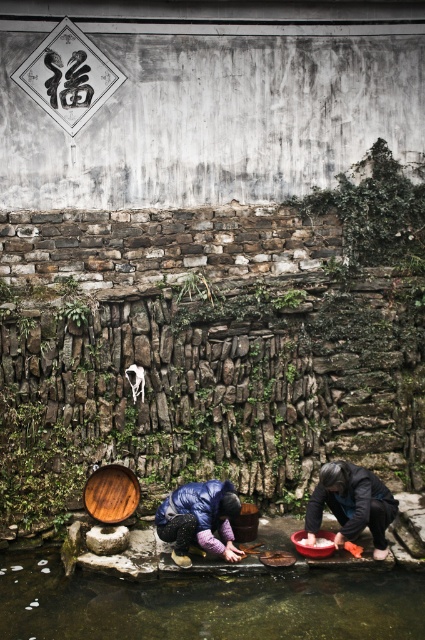
Find the location of a particular element. clear water at lower center is located at coordinates (206, 604).

Can you confirm if clear water at lower center is positioned to the right of purple down jacket at lower center?

Incorrect, clear water at lower center is not on the right side of purple down jacket at lower center.

Measure the distance between clear water at lower center and camera.

6.36 meters

At what (x,y) coordinates should I click in order to perform the action: click on clear water at lower center. Please return your answer as a coordinate pair (x, y). This screenshot has width=425, height=640. Looking at the image, I should click on (206, 604).

Does point (373, 484) come in front of point (215, 493)?

Yes.

Who is taller, dark gray fabric at lower right or purple down jacket at lower center?

Standing taller between the two is dark gray fabric at lower right.

Is point (348, 509) farther from camera compared to point (226, 492)?

No, (348, 509) is closer to viewer.

At what (x,y) coordinates should I click in order to perform the action: click on dark gray fabric at lower right. Please return your answer as a coordinate pair (x, y). The image size is (425, 640). Looking at the image, I should click on (351, 502).

In the scene shown: Measure the distance between point (368,628) and camera.

Point (368,628) is 6.53 meters away from camera.

Between clear water at lower center and dark gray fabric at lower right, which one has less height?

clear water at lower center is shorter.

Locate an element on the screen. The height and width of the screenshot is (640, 425). clear water at lower center is located at coordinates (206, 604).